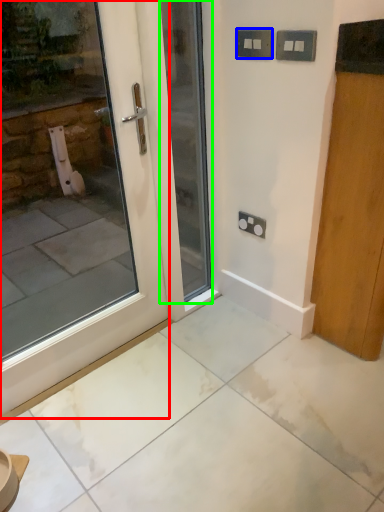
Question: Based on their relative distances, which object is farther from door (highlighted by a red box)? Choose from electric outlet (highlighted by a blue box) and door (highlighted by a green box).

Choices:
 (A) electric outlet
 (B) door

Answer: (A)